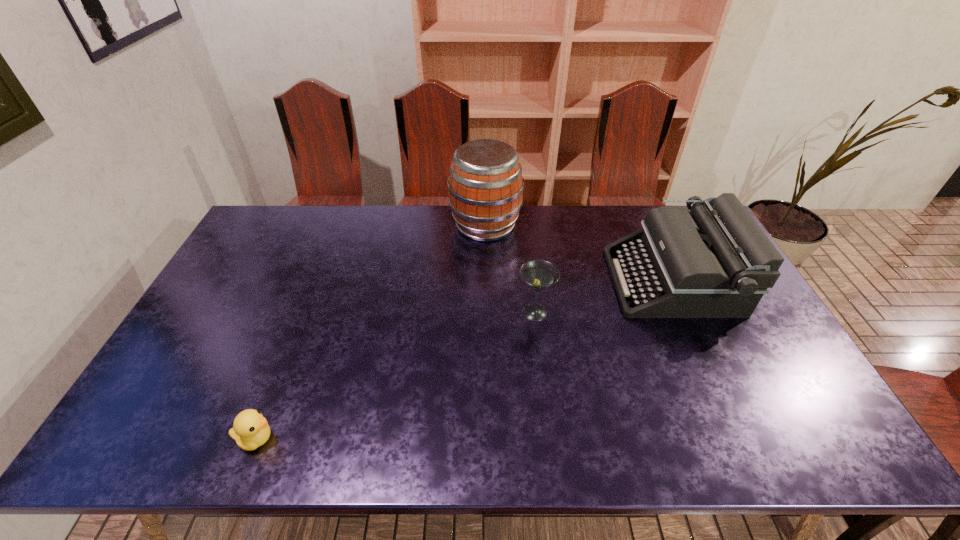
At what (x,y) coordinates should I click in order to perform the action: click on free region at the right edge. Please return your answer as a coordinate pair (x, y). This screenshot has width=960, height=540. Looking at the image, I should click on pyautogui.click(x=804, y=409).

In the image, there is a desktop. Where is `vacant region at the far left corner`? The image size is (960, 540). vacant region at the far left corner is located at coordinates (302, 218).

Where is `vacant space at the near left corner of the desktop`? The image size is (960, 540). vacant space at the near left corner of the desktop is located at coordinates (123, 434).

Where is `vacant space at the near right corner of the desktop`? This screenshot has width=960, height=540. vacant space at the near right corner of the desktop is located at coordinates (801, 437).

Find the location of a particular element. This screenshot has width=960, height=540. empty space that is in between the martini and the rightmost object is located at coordinates (603, 296).

Locate an element on the screen. The height and width of the screenshot is (540, 960). free spot between the shortest object and the typewriter is located at coordinates (464, 360).

Identify the location of empty location between the tallest object and the third tallest object. (510, 269).

I want to click on vacant point located between the tallest object and the rightmost object, so click(578, 253).

Find the location of a particular element. The height and width of the screenshot is (540, 960). empty location between the nearest object and the second tallest object is located at coordinates (464, 360).

Find the location of a particular element. The height and width of the screenshot is (540, 960). unoccupied position between the martini and the nearest object is located at coordinates (396, 376).